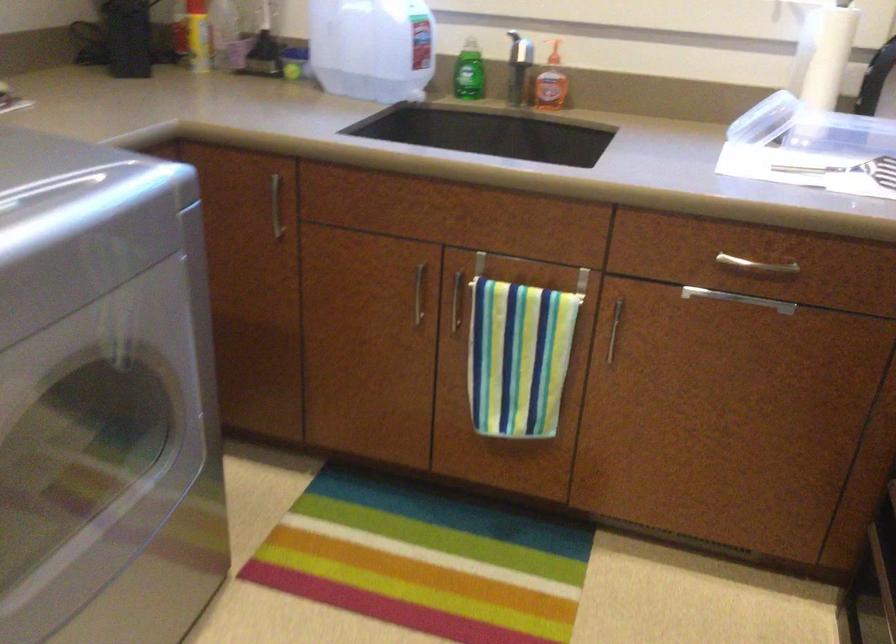
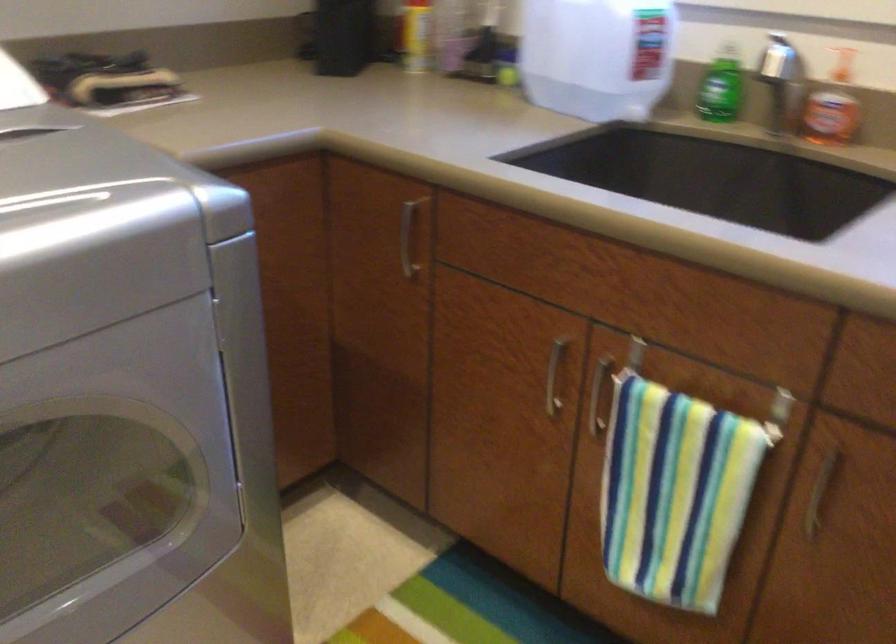
Find the pixel in the second image that matches [545,278] in the first image.

(727, 393)